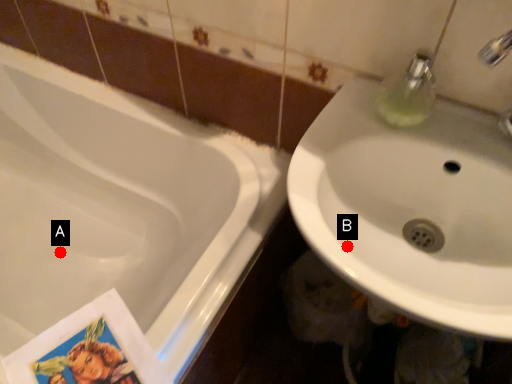
Question: Two points are circled on the image, labeled by A and B beside each circle. Which point appears closest to the camera in this image?

Choices:
 (A) A is closer
 (B) B is closer

Answer: (B)